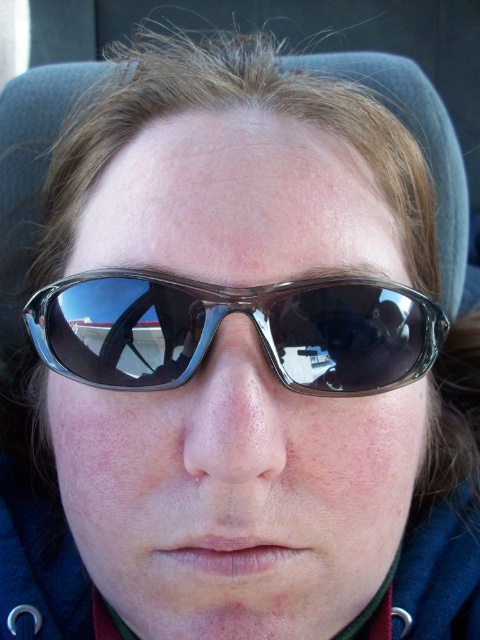
Measure the distance from transparent plastic goggles at center to matte black nose at center.

transparent plastic goggles at center and matte black nose at center are 1.45 inches apart.

Which is below, transparent plastic goggles at center or matte black nose at center?

matte black nose at center is lower down.

Between point (123, 353) and point (212, 445), which one is positioned behind?

The point (123, 353) is behind.

What are the coordinates of `transparent plastic goggles at center` in the screenshot? It's located at (219, 323).